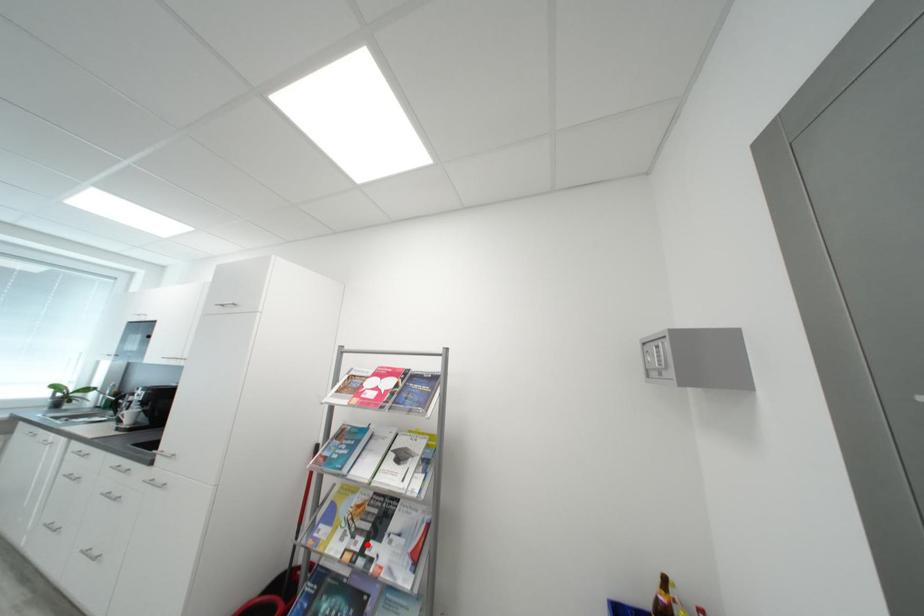
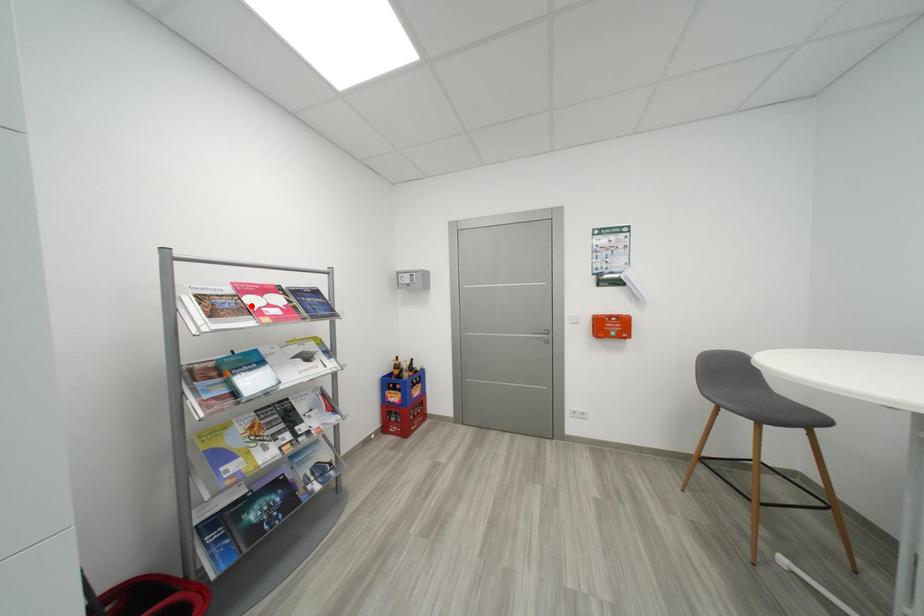
Consider the image. I am providing you with two images of the same scene from different viewpoints. A red point is marked on the first image and another point is marked on the second image. Is the marked point in image1 the same physical position as the marked point in image2?

No